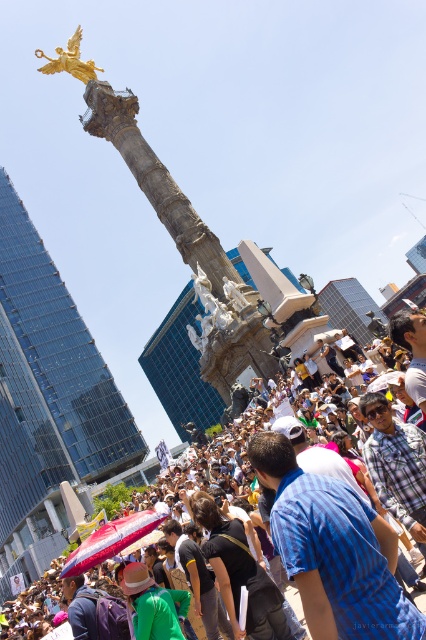
Which of these two, blue plaid shirt at center or matte black crowd at center, stands shorter?

blue plaid shirt at center is shorter.

Describe the element at coordinates (333, 550) in the screenshot. The width and height of the screenshot is (426, 640). I see `blue plaid shirt at center` at that location.

Is point (310, 563) closer to camera compared to point (198, 483)?

That is True.

Locate an element on the screen. The height and width of the screenshot is (640, 426). blue plaid shirt at center is located at coordinates (333, 550).

Does point (252, 429) come behind point (74, 74)?

That is False.

Can you confirm if matte black crowd at center is positioned to the left of gold polished statue at upper left?

Incorrect, matte black crowd at center is not on the left side of gold polished statue at upper left.

Which is in front, point (123, 493) or point (48, 72)?

Point (48, 72) is in front.

Find the location of a particular element. The width and height of the screenshot is (426, 640). matte black crowd at center is located at coordinates (210, 474).

Which is behind, point (307, 589) or point (75, 36)?

Positioned behind is point (75, 36).

Is point (336, 493) in front of point (40, 54)?

Yes, point (336, 493) is closer to viewer.

Does point (321, 541) come behind point (86, 76)?

No, (321, 541) is closer to viewer.

Find the location of a particular element. This screenshot has width=426, height=640. blue plaid shirt at center is located at coordinates (333, 550).